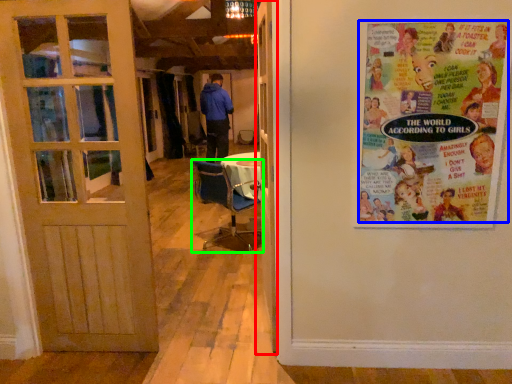
Question: Considering the real-world distances, which object is farthest from door (highlighted by a red box)? poster (highlighted by a blue box) or chair (highlighted by a green box)?

Choices:
 (A) poster
 (B) chair

Answer: (B)